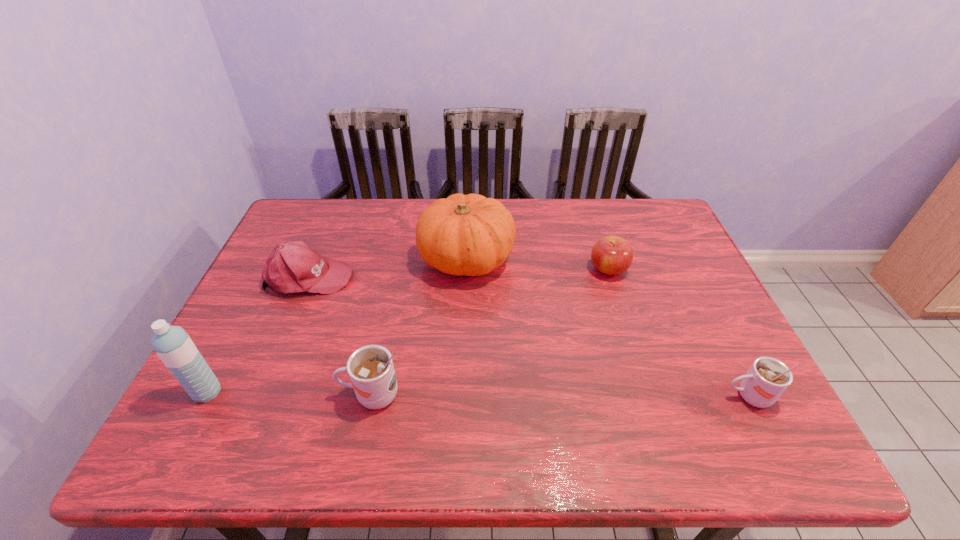
Identify the location of free space between the rightmost object and the baseball cap. (529, 336).

Where is `free point between the left cup and the second object from right to left`? free point between the left cup and the second object from right to left is located at coordinates (490, 332).

Where is `unoccupied area between the pumpkin and the baseball cap`? unoccupied area between the pumpkin and the baseball cap is located at coordinates (388, 267).

Find the location of a particular element. vacant area between the tallest object and the right cup is located at coordinates (478, 394).

Where is `unoccupied position between the baseball cap and the fourth shortest object`? The height and width of the screenshot is (540, 960). unoccupied position between the baseball cap and the fourth shortest object is located at coordinates (341, 336).

Where is `free spot between the rightmost object and the pumpkin`? The height and width of the screenshot is (540, 960). free spot between the rightmost object and the pumpkin is located at coordinates (608, 327).

The height and width of the screenshot is (540, 960). In order to click on vacant area that lies between the fourth shortest object and the fifth object from left to right in this screenshot , I will do `click(490, 332)`.

Find the location of `empty location between the baseball cap and the fourth shortest object`. empty location between the baseball cap and the fourth shortest object is located at coordinates (341, 336).

Choose which object is the fifth nearest neighbor to the right cup. Please provide its 2D coordinates. Your answer should be formatted as a tuple, i.e. [(x, y)], where the tuple contains the x and y coordinates of a point satisfying the conditions above.

[(172, 344)]

Identify which object is the closest to the baseball cap. Please provide its 2D coordinates. Your answer should be formatted as a tuple, i.e. [(x, y)], where the tuple contains the x and y coordinates of a point satisfying the conditions above.

[(471, 235)]